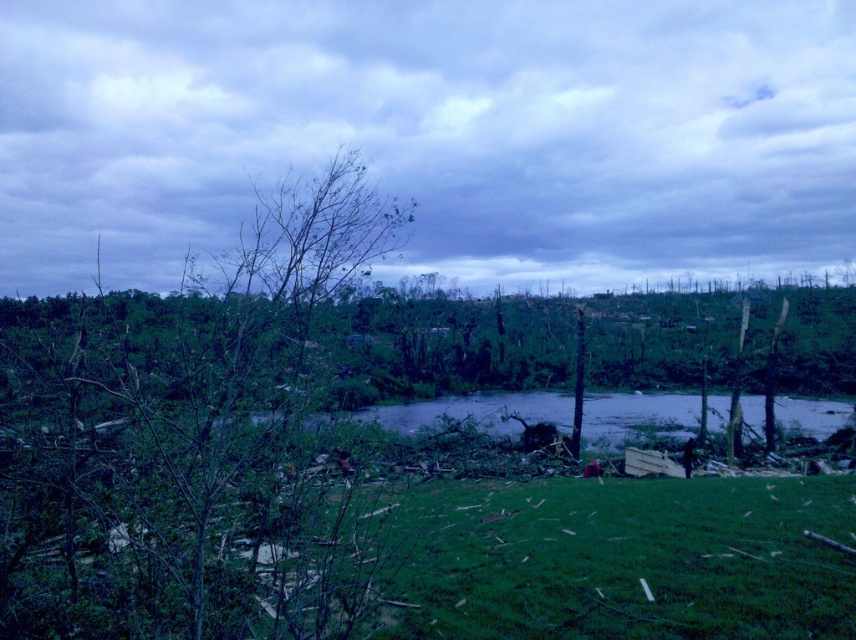
Question: Which point is closer to the camera?

Choices:
 (A) (765, 592)
 (B) (708, 422)
 (C) (288, 198)

Answer: (A)

Question: Is green grass at lower center positioned in front of clear water at center?

Choices:
 (A) yes
 (B) no

Answer: (A)

Question: Which point is closer to the camera taking this photo?

Choices:
 (A) (528, 410)
 (B) (571, 580)
 (C) (192, 304)

Answer: (B)

Question: Where is green grass at lower center located in relation to clear water at center in the image?

Choices:
 (A) below
 (B) above

Answer: (B)

Question: Which point appears farthest from the camera in this image?

Choices:
 (A) (385, 509)
 (B) (831, 404)
 (C) (187, 369)

Answer: (B)

Question: Observing the image, what is the correct spatial positioning of green leafy tree at center in reference to clear water at center?

Choices:
 (A) above
 (B) below

Answer: (A)